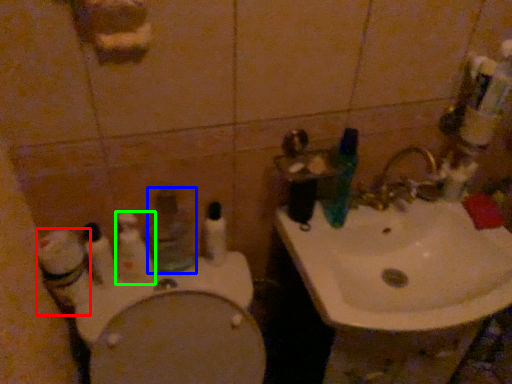
Question: Which object is the closest to the cleaning product (highlighted by a red box)? Choose among these: mouthwash (highlighted by a blue box) or toothbrush (highlighted by a green box).

Choices:
 (A) mouthwash
 (B) toothbrush

Answer: (B)